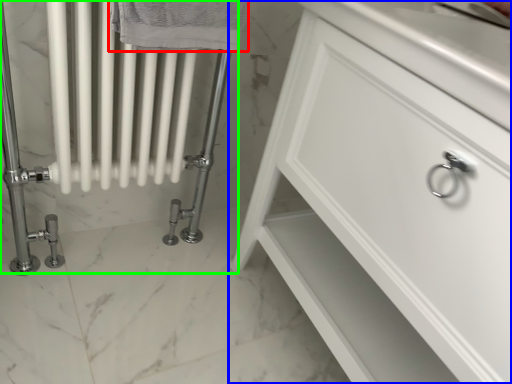
Question: Which object is positioned farthest from bath towel (highlighted by a red box)? Select from bathroom cabinet (highlighted by a blue box) and bath (highlighted by a green box).

Choices:
 (A) bathroom cabinet
 (B) bath

Answer: (A)